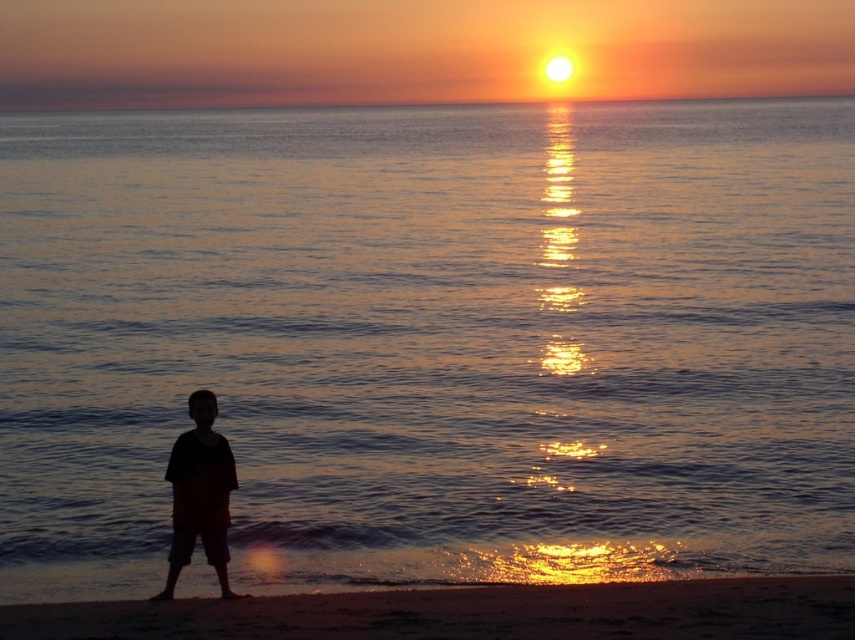
In the scene shown: Is sandy beach at lower center shorter than silhouette fabric shorts at lower left?

Yes.

Which is below, sandy beach at lower center or silhouette fabric shorts at lower left?

sandy beach at lower center is below.

Does point (251, 630) come in front of point (214, 520)?

Yes, point (251, 630) is in front of point (214, 520).

This screenshot has width=855, height=640. I want to click on sandy beach at lower center, so click(x=470, y=612).